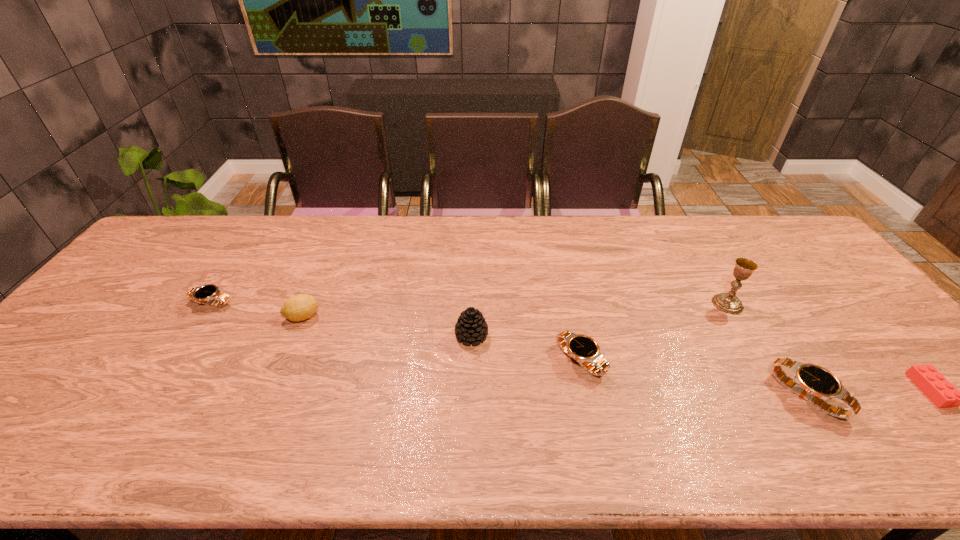
Identify the location of free space in the image that satisfies the following two spatial constraints: 1. on the back side of the shortest object; 2. at the stem end of the second object from left to right. Image resolution: width=960 pixels, height=540 pixels. (864, 316).

Locate an element on the screen. This screenshot has width=960, height=540. free space in the image that satisfies the following two spatial constraints: 1. on the back side of the Lego; 2. at the narrow end of the sixth shortest object is located at coordinates (881, 335).

This screenshot has height=540, width=960. I want to click on free region that satisfies the following two spatial constraints: 1. on the back side of the rightmost watch; 2. at the narrow end of the fifth object from right to left, so click(767, 335).

Image resolution: width=960 pixels, height=540 pixels. In order to click on free space that satisfies the following two spatial constraints: 1. at the narrow end of the Lego; 2. on the right side of the third object from left to right in this screenshot , I will do `click(470, 390)`.